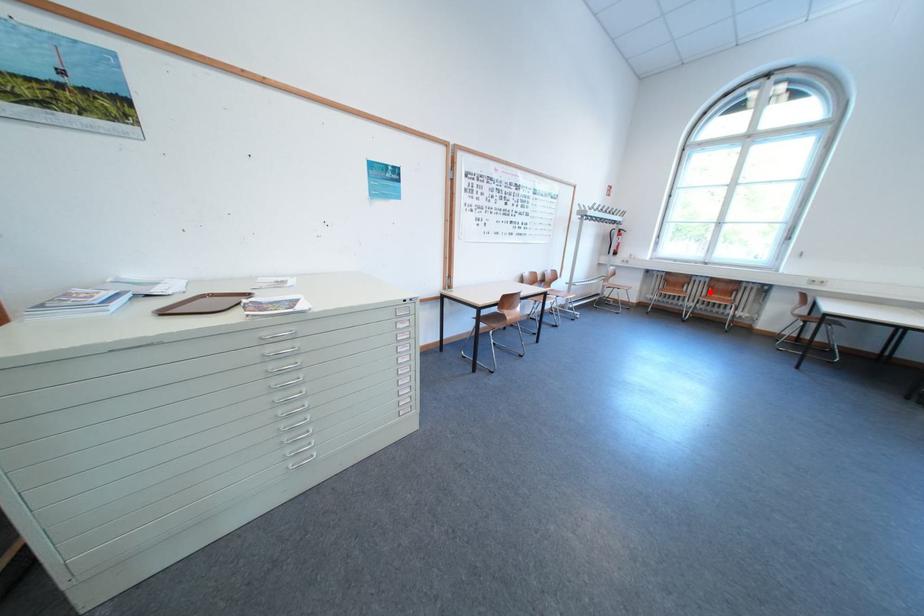
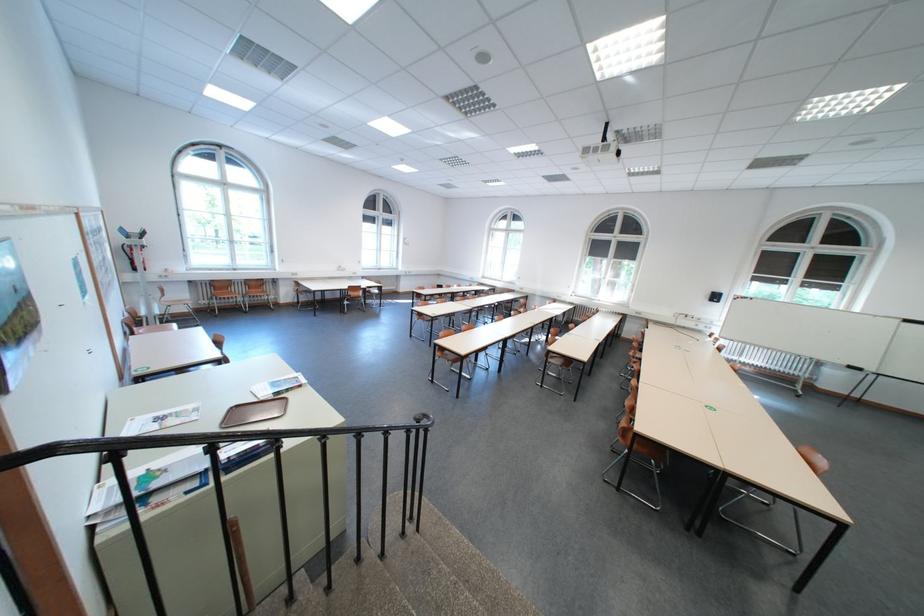
The point at the highlighted location is marked in the first image. Where is the corresponding point in the second image?

(252, 291)